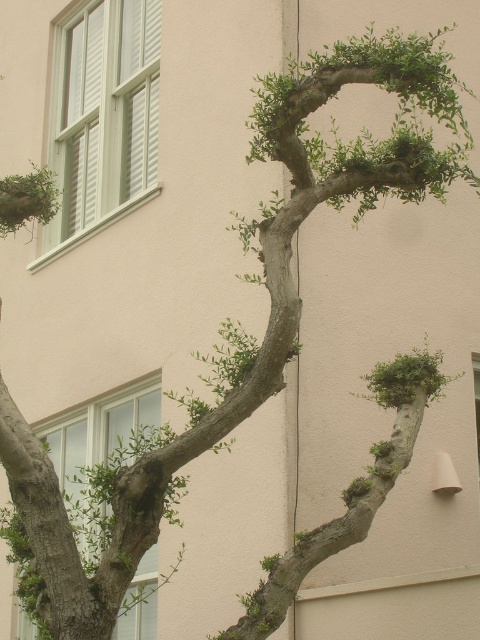
You are standing in front of the building and see the point marked at coordinates (408,380). What object is located at that point?

The point at coordinates (408,380) indicates a green leafy branch at center right.